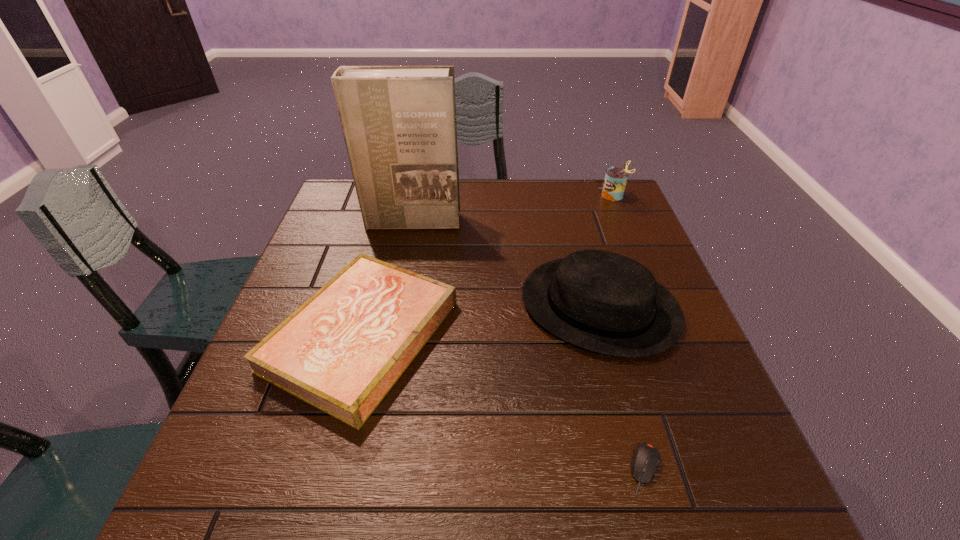
The image size is (960, 540). I want to click on the fourth nearest object, so click(399, 124).

The image size is (960, 540). I want to click on the tallest object, so click(399, 124).

Find the location of a particular element. can is located at coordinates 614,184.

The width and height of the screenshot is (960, 540). I want to click on fedora, so click(600, 301).

Where is `the second shortest object`? the second shortest object is located at coordinates (341, 351).

You are a GUI agent. You are given a task and a screenshot of the screen. Output one action in this format:
    pyautogui.click(x=<x>, y=<y>)
    Task: Click on the nearest object
    The width and height of the screenshot is (960, 540).
    Given the screenshot: What is the action you would take?
    pyautogui.click(x=646, y=459)

Locate an element on the screen. the shortest object is located at coordinates (646, 459).

Locate an element on the screen. Image resolution: width=960 pixels, height=540 pixels. free location located on the cover of the phonebook is located at coordinates (x=399, y=281).

You are a GUI agent. You are given a task and a screenshot of the screen. Output one action in this format:
    pyautogui.click(x=<x>, y=<y>)
    Task: Click on the free spot located 0.120m on the front of the farthest object
    The width and height of the screenshot is (960, 540).
    Given the screenshot: What is the action you would take?
    pyautogui.click(x=625, y=227)

Identify the location of vacant space located on the front of the fedora. (636, 440).